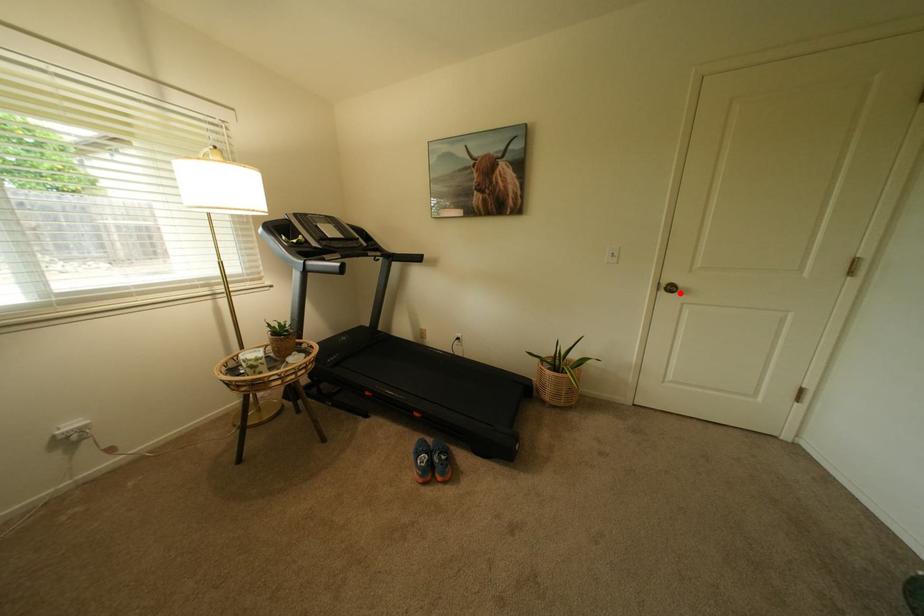
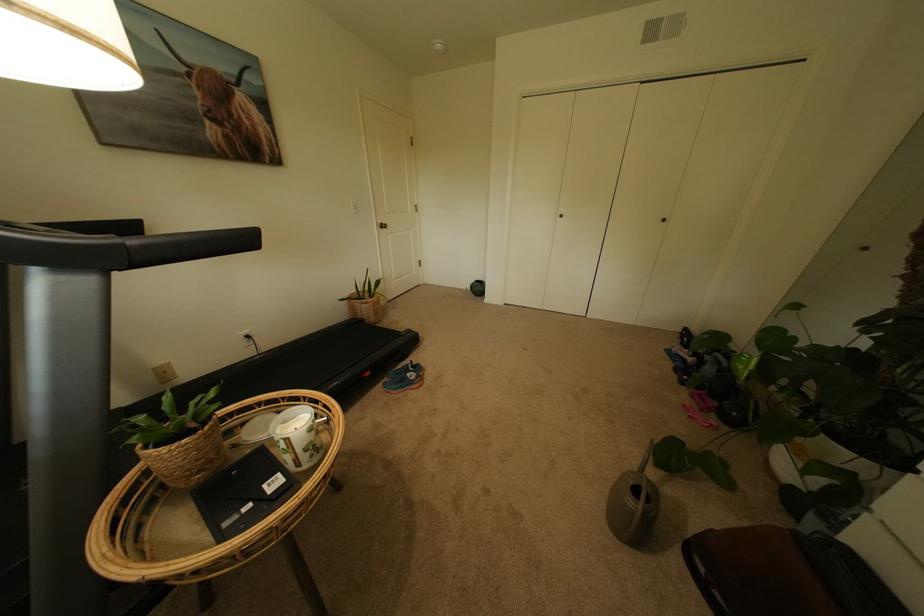
Locate, in the second image, the point that corresponds to the highlighted location in the first image.

(394, 229)